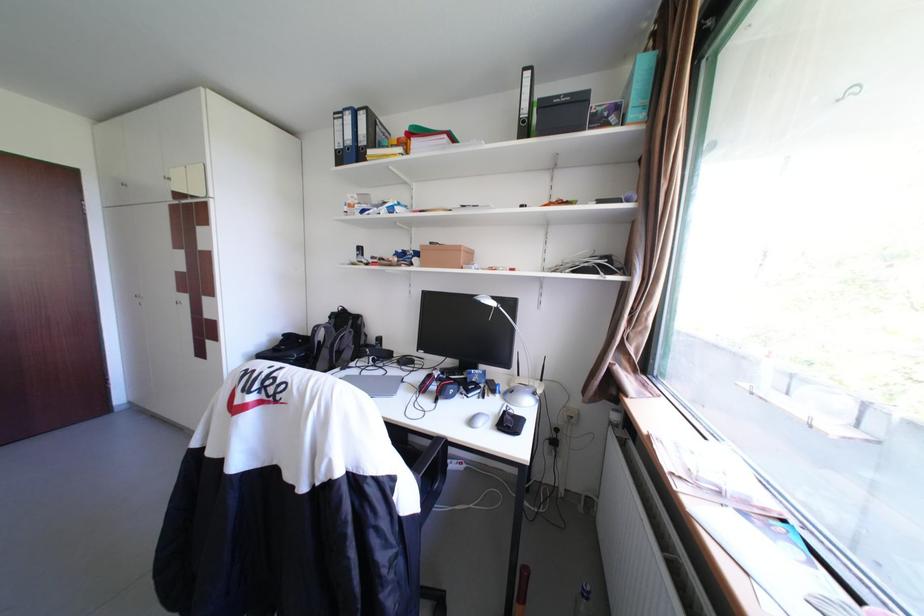
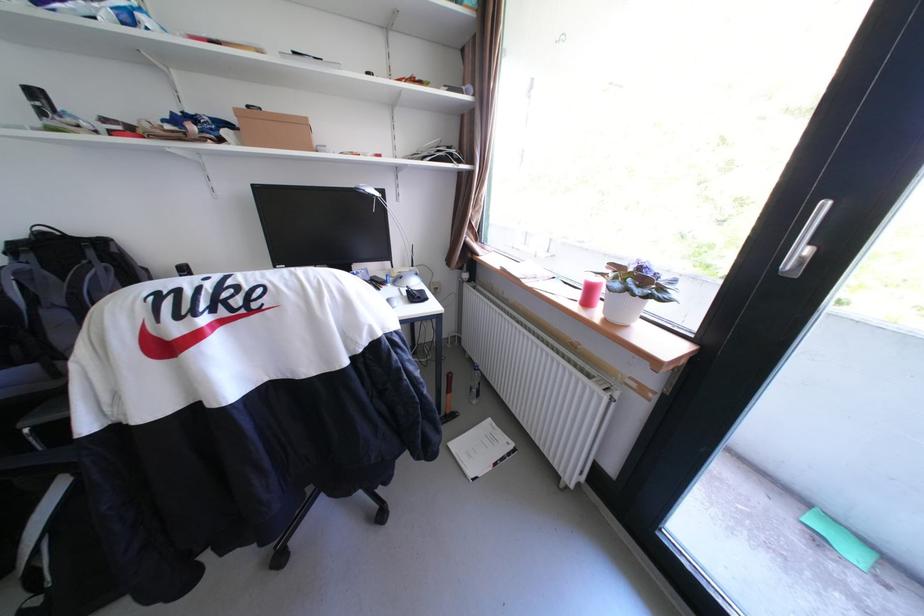
In the second image, find the point that corresponds to (x=502, y=307) in the first image.

(382, 198)